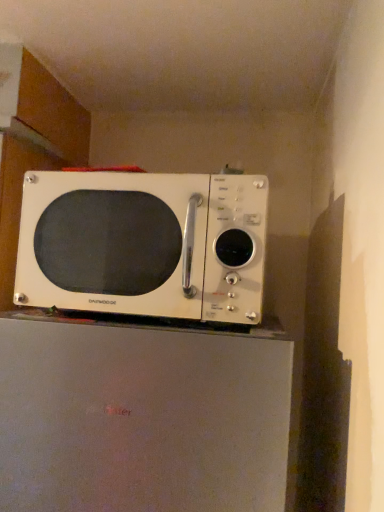
Question: From a real-world perspective, relative to white matte microwave at upper center, is white matte microwave at upper center vertically above or below?

Choices:
 (A) below
 (B) above

Answer: (A)

Question: Is point (173, 464) positioned closer to the camera than point (23, 290)?

Choices:
 (A) closer
 (B) farther

Answer: (A)

Question: Is white matte microwave at upper center bigger or smaller than white matte microwave at upper center?

Choices:
 (A) small
 (B) big

Answer: (B)

Question: From a real-world perspective, is white matte microwave at upper center above or below white matte microwave at upper center?

Choices:
 (A) below
 (B) above

Answer: (B)

Question: From the image's perspective, is white matte microwave at upper center above or below white matte microwave at upper center?

Choices:
 (A) below
 (B) above

Answer: (B)

Question: In terms of width, does white matte microwave at upper center look wider or thinner when compared to white matte microwave at upper center?

Choices:
 (A) wide
 (B) thin

Answer: (B)

Question: Is point (112, 284) closer or farther from the camera than point (276, 459)?

Choices:
 (A) farther
 (B) closer

Answer: (A)